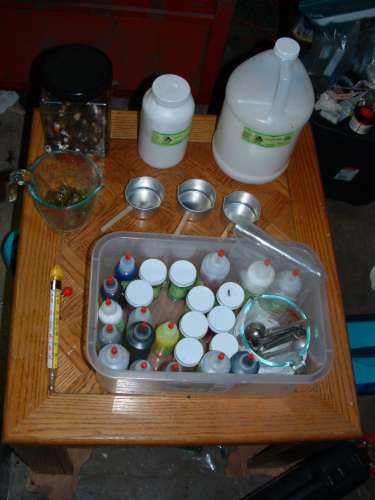
The image size is (375, 500). In order to click on table in this screenshot , I will do `click(131, 426)`.